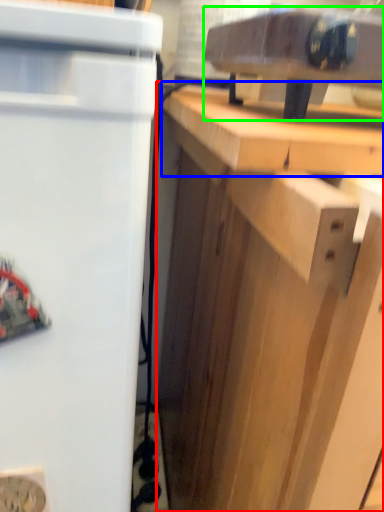
Question: Which object is positioned farthest from cabinetry (highlighted by a red box)? Select from counter top (highlighted by a blue box) and appliance (highlighted by a green box).

Choices:
 (A) counter top
 (B) appliance

Answer: (B)